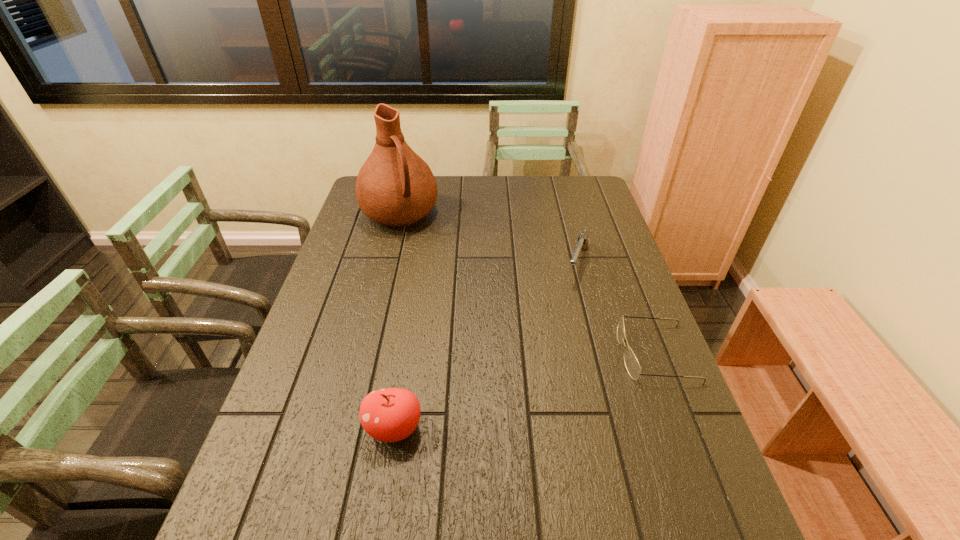
Find the location of a particular element. This screenshot has width=960, height=540. vacant region located 0.300m on the front-facing side of the spectacles is located at coordinates (501, 354).

The width and height of the screenshot is (960, 540). What are the coordinates of `vacant space located 0.150m on the front-facing side of the spectacles` in the screenshot? It's located at (561, 354).

Where is `free space located 0.140m on the side of the farthest object with the handle`? This screenshot has height=540, width=960. free space located 0.140m on the side of the farthest object with the handle is located at coordinates (426, 259).

Where is `vacant point located on the side of the farthest object with the handle`? vacant point located on the side of the farthest object with the handle is located at coordinates (420, 248).

Locate an element on the screen. vacant space positioned 0.210m on the side of the farthest object with the handle is located at coordinates (434, 272).

Locate an element on the screen. vacant area located aiming along the barrel of the gun is located at coordinates (570, 302).

At what (x,y) coordinates should I click in order to perform the action: click on vacant space located 0.240m aiming along the barrel of the gun. Please return your answer as a coordinate pair (x, y). The height and width of the screenshot is (540, 960). Looking at the image, I should click on (556, 342).

Locate an element on the screen. The width and height of the screenshot is (960, 540). free space located 0.270m aiming along the barrel of the gun is located at coordinates (553, 351).

This screenshot has width=960, height=540. In order to click on object present at the far edge in this screenshot , I will do `click(395, 187)`.

In order to click on object located in the left edge section of the desktop in this screenshot , I will do `click(395, 187)`.